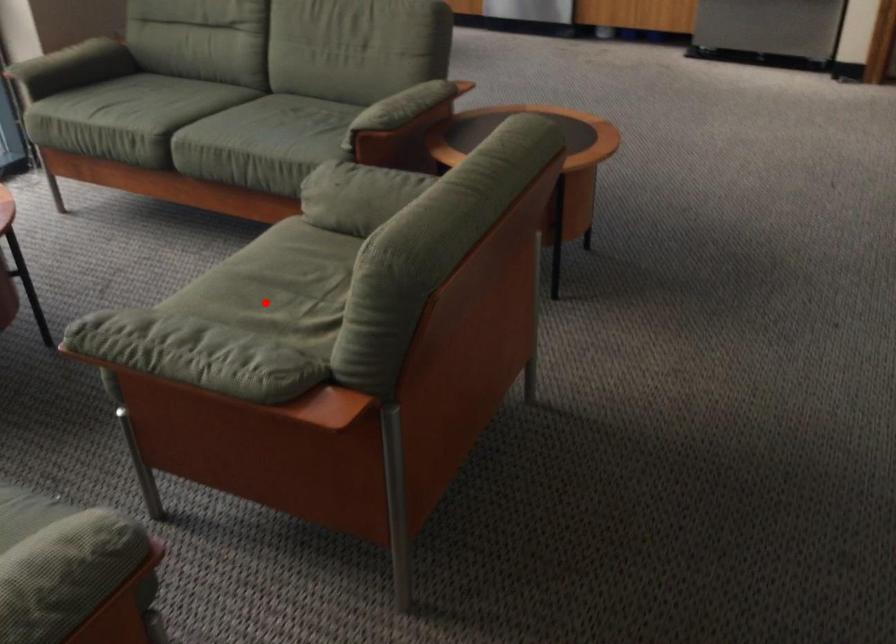
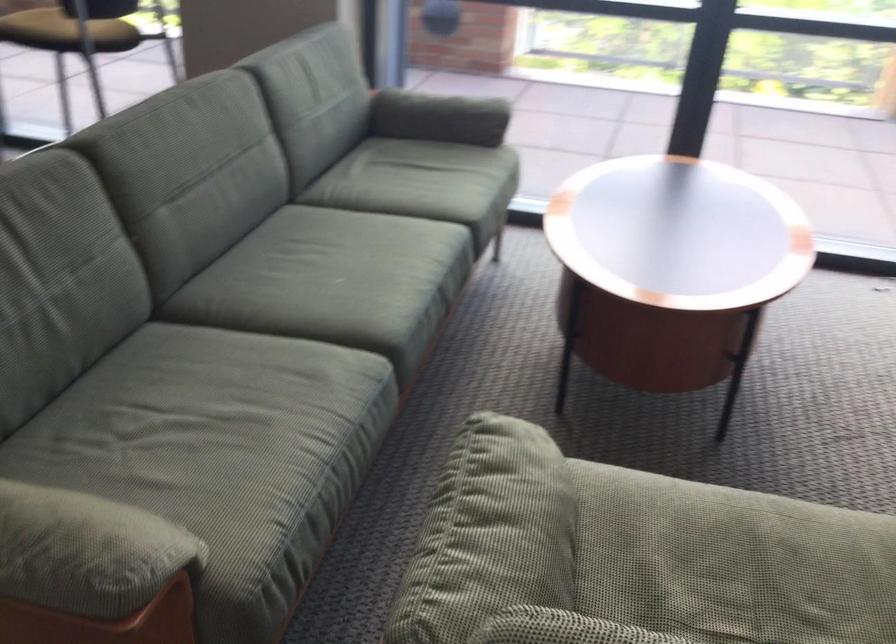
Question: I am providing you with two images of the same scene from different viewpoints. In image1, a red point is highlighted. Considering the same 3D point in image2, which of the following is correct?

Choices:
 (A) It is closer
 (B) It is farther

Answer: (A)